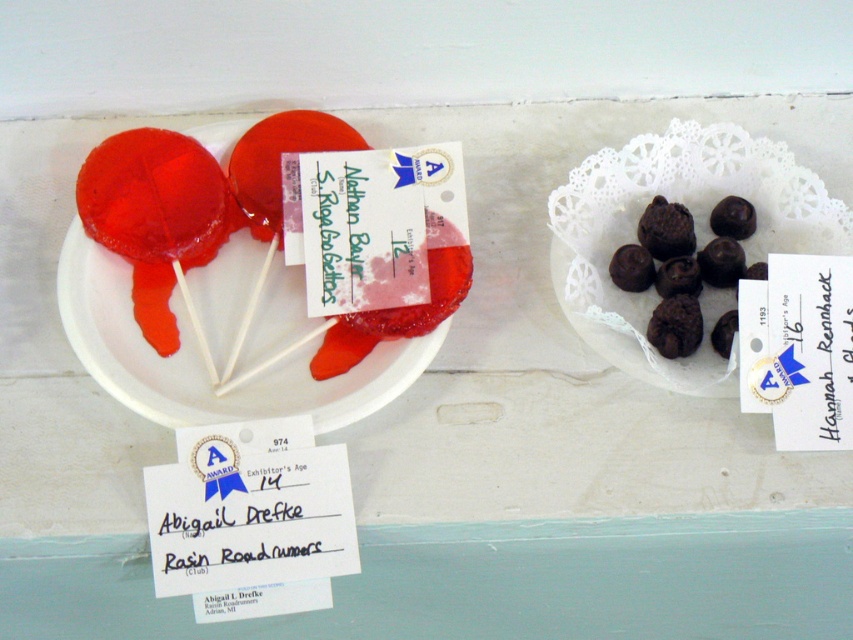
Question: Does chocolate truffles at center come in front of chocolate matte truffles at center?

Choices:
 (A) no
 (B) yes

Answer: (B)

Question: Among these points, which one is nearest to the camera?

Choices:
 (A) (778, 225)
 (B) (668, 301)
 (C) (223, 150)

Answer: (B)

Question: Is chocolate truffles at center behind chocolate matte truffles at center?

Choices:
 (A) no
 (B) yes

Answer: (A)

Question: Observing the image, what is the correct spatial positioning of translucent gelatin at center in reference to chocolate truffles at center?

Choices:
 (A) right
 (B) left

Answer: (B)

Question: Among these points, which one is nearest to the camera?

Choices:
 (A) (614, 253)
 (B) (593, 317)
 (C) (151, 413)

Answer: (C)

Question: Which object is closer to the camera taking this photo?

Choices:
 (A) translucent gelatin at center
 (B) chocolate truffles at center

Answer: (A)